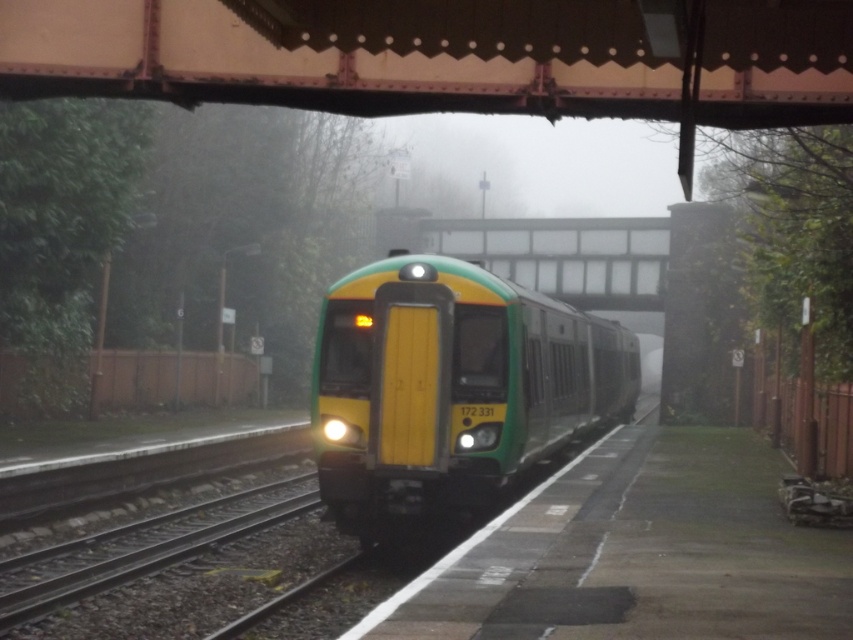
Which is more to the right, metallic brown bridge at upper center or green matte train at center?

From the viewer's perspective, metallic brown bridge at upper center appears more on the right side.

Is point (361, 77) closer to viewer compared to point (354, 472)?

That is True.

At what (x,y) coordinates should I click in order to perform the action: click on metallic brown bridge at upper center. Please return your answer as a coordinate pair (x, y). The image size is (853, 640). Looking at the image, I should click on (445, 54).